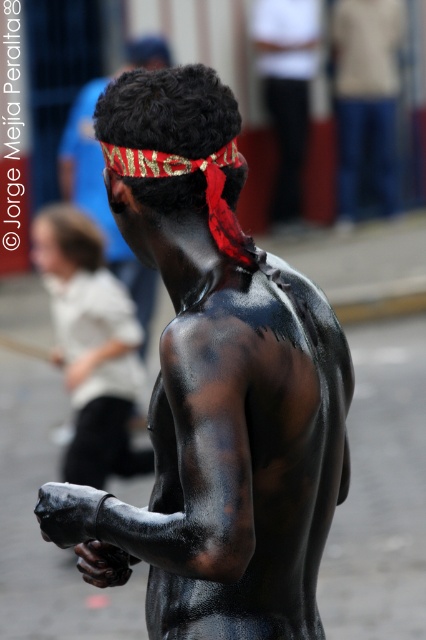
Based on the scene description, what object is located at the coordinates point [215,387]?

The black matte skin at center is located at point [215,387].

You are an observer looking at the scene. There are two descriptions of the person at the center of the image. One is labeled as black matte skin at center and the other as shiny black skin at center. Which one is positioned lower on the body?

The black matte skin at center is located below the shiny black skin at center, so the black matte skin at center is positioned lower on the body.